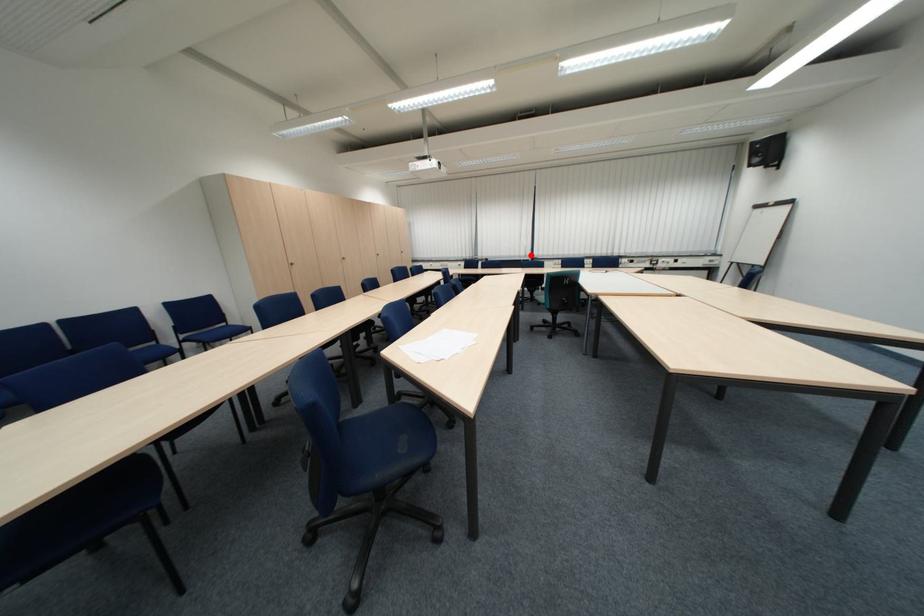
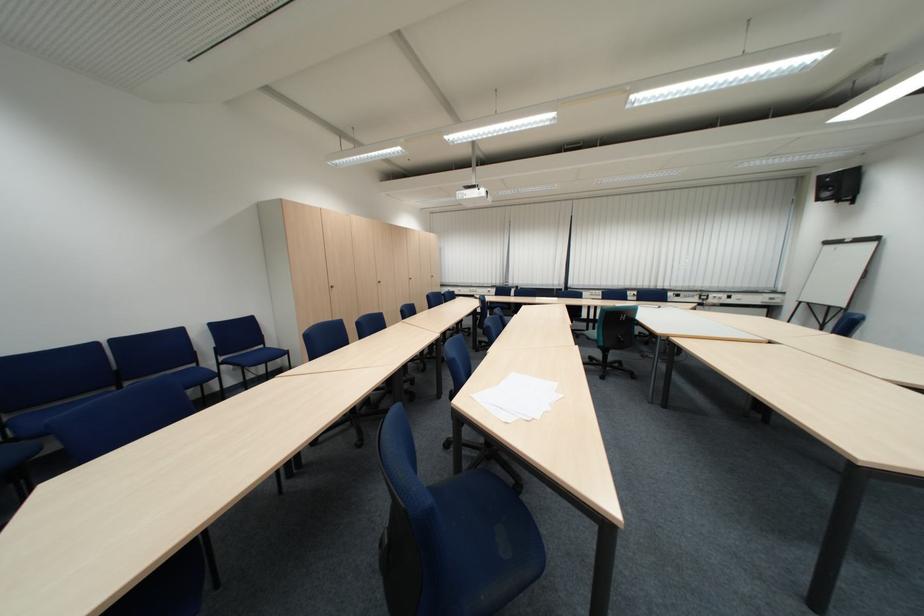
Question: I am providing you with two images of the same scene from different viewpoints. A red point is marked on the first image. Is the red point's position out of view in image 2?

Choices:
 (A) Yes
 (B) No

Answer: (B)